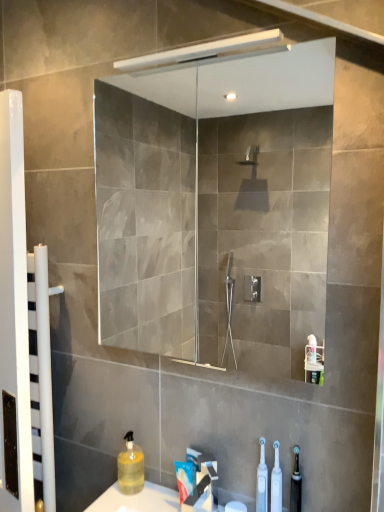
How much space does white plastic toothbrush at lower center, the 2th cleaning product in the left-to-right sequence, occupy vertically?

It is 9.53 inches.

The height and width of the screenshot is (512, 384). What are the coordinates of `white plastic toothbrush at lower center, which is the 1th cleaning product from front to back` in the screenshot? It's located at (276, 482).

The width and height of the screenshot is (384, 512). In order to click on white matte toothpaste at lower center in this screenshot , I will do `click(185, 478)`.

Image resolution: width=384 pixels, height=512 pixels. What do you see at coordinates (14, 315) in the screenshot?
I see `white glossy towel rack at left` at bounding box center [14, 315].

Locate an element on the screen. This screenshot has width=384, height=512. translucent yellow liquid at lower left, which is counted as the 2th cleaning product, starting from the right is located at coordinates (130, 467).

From the image's perspective, is white plastic toothbrushes at lower center, placed as the second toiletry when sorted from right to left, beneath translucent yellow liquid at lower left, marked as the 1th cleaning product in a left-to-right arrangement?

No.

From a real-world perspective, is white plastic toothbrushes at lower center, acting as the first toiletry starting from the left, below translucent yellow liquid at lower left, the first cleaning product in the back-to-front sequence?

No.

What's the angular difference between white plastic toothbrushes at lower center, acting as the first toiletry starting from the left, and translucent yellow liquid at lower left, the first cleaning product in the back-to-front sequence,'s facing directions?

white plastic toothbrushes at lower center, acting as the first toiletry starting from the left, and translucent yellow liquid at lower left, the first cleaning product in the back-to-front sequence, are facing 2.3 degrees away from each other.

Between white plastic toothbrushes at lower center, placed as the second toiletry when sorted from right to left, and translucent yellow liquid at lower left, which appears as the second cleaning product when viewed from the front, which one has less height?

translucent yellow liquid at lower left, which appears as the second cleaning product when viewed from the front, is shorter.

Does point (15, 251) appear closer or farther from the camera than point (276, 448)?

Point (15, 251) is positioned closer to the camera compared to point (276, 448).

From the image's perspective, is white glossy towel rack at left above or below white plastic toothbrush at lower center, the 2th cleaning product positioned from the back?

white glossy towel rack at left is situated higher than white plastic toothbrush at lower center, the 2th cleaning product positioned from the back, in the image.

The width and height of the screenshot is (384, 512). I want to click on cleaning product lying in front of the white glossy towel rack at left, so click(276, 482).

Are transparent glass mirror at upper center and translucent plastic toothbrush at lower right, positioned as the first toiletry in right-to-left order, making contact?

transparent glass mirror at upper center and translucent plastic toothbrush at lower right, positioned as the first toiletry in right-to-left order, are clearly separated.

Looking at the image, does transparent glass mirror at upper center seem bigger or smaller compared to translucent plastic toothbrush at lower right, acting as the second toiletry starting from the left?

Considering their sizes, transparent glass mirror at upper center takes up more space than translucent plastic toothbrush at lower right, acting as the second toiletry starting from the left.

From a real-world perspective, is transparent glass mirror at upper center positioned under translucent plastic toothbrush at lower right, positioned as the first toiletry in right-to-left order, based on gravity?

Incorrect, from a real-world perspective, transparent glass mirror at upper center is higher than translucent plastic toothbrush at lower right, positioned as the first toiletry in right-to-left order.

Consider the image. Which of these two, transparent glass mirror at upper center or translucent plastic toothbrush at lower right, acting as the second toiletry starting from the left, is thinner?

With smaller width is translucent plastic toothbrush at lower right, acting as the second toiletry starting from the left.

Is white plastic toothbrush at lower center, the 1th cleaning product in the right-to-left sequence, aimed at transparent glass mirror at upper center?

No, white plastic toothbrush at lower center, the 1th cleaning product in the right-to-left sequence, is not aimed at transparent glass mirror at upper center.

In terms of size, does white plastic toothbrush at lower center, the 2th cleaning product positioned from the back, appear bigger or smaller than transparent glass mirror at upper center?

white plastic toothbrush at lower center, the 2th cleaning product positioned from the back, is smaller than transparent glass mirror at upper center.

Is the surface of translucent yellow liquid at lower left, marked as the 1th cleaning product in a left-to-right arrangement, in direct contact with translucent plastic toothbrush at lower right, positioned as the first toiletry in right-to-left order?

They are not placed beside each other.

Which of these two, translucent yellow liquid at lower left, the first cleaning product in the back-to-front sequence, or translucent plastic toothbrush at lower right, positioned as the first toiletry in right-to-left order, stands taller?

With more height is translucent plastic toothbrush at lower right, positioned as the first toiletry in right-to-left order.

Based on the photo, which object is further away from the camera, translucent yellow liquid at lower left, the first cleaning product in the back-to-front sequence, or translucent plastic toothbrush at lower right, acting as the second toiletry starting from the left?

translucent yellow liquid at lower left, the first cleaning product in the back-to-front sequence, is more distant.

Does point (130, 486) come in front of point (300, 499)?

No, (130, 486) is behind (300, 499).

Could you tell me if white plastic toothbrush at lower center, the 2th cleaning product in the left-to-right sequence, is facing translucent yellow liquid at lower left, which is counted as the 2th cleaning product, starting from the right?

No, white plastic toothbrush at lower center, the 2th cleaning product in the left-to-right sequence, is not turned towards translucent yellow liquid at lower left, which is counted as the 2th cleaning product, starting from the right.

Is white plastic toothbrush at lower center, the 2th cleaning product in the left-to-right sequence, positioned beyond the bounds of translucent yellow liquid at lower left, which appears as the second cleaning product when viewed from the front?

That's correct, white plastic toothbrush at lower center, the 2th cleaning product in the left-to-right sequence, is outside of translucent yellow liquid at lower left, which appears as the second cleaning product when viewed from the front.

From the image's perspective, does white plastic toothbrush at lower center, which is the 1th cleaning product from front to back, appear higher than translucent yellow liquid at lower left, marked as the 1th cleaning product in a left-to-right arrangement?

Indeed, from the image's perspective, white plastic toothbrush at lower center, which is the 1th cleaning product from front to back, is shown above translucent yellow liquid at lower left, marked as the 1th cleaning product in a left-to-right arrangement.

From a real-world perspective, which object stands above the other?

white plastic toothbrush at lower center, which is the 1th cleaning product from front to back.

Is white plastic toothbrush at lower center, which is the 1th cleaning product from front to back, inside the boundaries of white plastic toothbrushes at lower center, placed as the second toiletry when sorted from right to left, or outside?

white plastic toothbrush at lower center, which is the 1th cleaning product from front to back, cannot be found inside white plastic toothbrushes at lower center, placed as the second toiletry when sorted from right to left.

Is white plastic toothbrush at lower center, which is the 1th cleaning product from front to back, wider than white plastic toothbrushes at lower center, acting as the first toiletry starting from the left?

In fact, white plastic toothbrush at lower center, which is the 1th cleaning product from front to back, might be narrower than white plastic toothbrushes at lower center, acting as the first toiletry starting from the left.

From a real-world perspective, relative to white plastic toothbrushes at lower center, acting as the first toiletry starting from the left, is white plastic toothbrush at lower center, the 2th cleaning product in the left-to-right sequence, vertically above or below?

white plastic toothbrush at lower center, the 2th cleaning product in the left-to-right sequence, is below white plastic toothbrushes at lower center, acting as the first toiletry starting from the left.

From the translucent yellow liquid at lower left, which is counted as the 2th cleaning product, starting from the right, count 1st toiletrys forward and point to it. Please provide its 2D coordinates.

[(262, 481)]

This screenshot has width=384, height=512. I want to click on screen door above the white plastic toothbrush at lower center, which is the 1th cleaning product from front to back (from a real-world perspective), so click(14, 315).

When comparing their distances from translucent yellow liquid at lower left, marked as the 1th cleaning product in a left-to-right arrangement, does white glossy towel rack at left or white matte toothpaste at lower center seem further?

Among the two, white glossy towel rack at left is located further to translucent yellow liquid at lower left, marked as the 1th cleaning product in a left-to-right arrangement.

From the image, which object appears to be farther from white matte toothpaste at lower center, white glossy towel rack at left or transparent glass mirror at upper center?

Based on the image, transparent glass mirror at upper center appears to be further to white matte toothpaste at lower center.

When comparing their distances from white matte toothpaste at lower center, does white plastic toothbrushes at lower center, acting as the first toiletry starting from the left, or translucent yellow liquid at lower left, marked as the 1th cleaning product in a left-to-right arrangement, seem further?

The object further to white matte toothpaste at lower center is white plastic toothbrushes at lower center, acting as the first toiletry starting from the left.

When comparing their distances from white matte toothpaste at lower center, does white glossy towel rack at left or white plastic toothbrushes at lower center, placed as the second toiletry when sorted from right to left, seem closer?

white plastic toothbrushes at lower center, placed as the second toiletry when sorted from right to left, lies closer to white matte toothpaste at lower center than the other object.

When comparing their distances from white plastic toothbrush at lower center, which is the 1th cleaning product from front to back, does translucent yellow liquid at lower left, which appears as the second cleaning product when viewed from the front, or white glossy towel rack at left seem further?

Among the two, white glossy towel rack at left is located further to white plastic toothbrush at lower center, which is the 1th cleaning product from front to back.

Considering their positions, is transparent glass mirror at upper center positioned closer to translucent plastic toothbrush at lower right, positioned as the first toiletry in right-to-left order, than white plastic toothbrush at lower center, the 1th cleaning product in the right-to-left sequence?

white plastic toothbrush at lower center, the 1th cleaning product in the right-to-left sequence, is closer to translucent plastic toothbrush at lower right, positioned as the first toiletry in right-to-left order.

From the picture: Looking at the image, which one is located further to translucent plastic toothbrush at lower right, positioned as the first toiletry in right-to-left order, translucent yellow liquid at lower left, marked as the 1th cleaning product in a left-to-right arrangement, or white matte toothpaste at lower center?

Based on the image, translucent yellow liquid at lower left, marked as the 1th cleaning product in a left-to-right arrangement, appears to be further to translucent plastic toothbrush at lower right, positioned as the first toiletry in right-to-left order.

Based on the photo, which object lies nearer to the anchor point transparent glass mirror at upper center, white matte toothpaste at lower center or white plastic toothbrushes at lower center, placed as the second toiletry when sorted from right to left?

white matte toothpaste at lower center.

The height and width of the screenshot is (512, 384). I want to click on cleaning product between transparent glass mirror at upper center and translucent yellow liquid at lower left, which appears as the second cleaning product when viewed from the front, in the up-down direction, so click(276, 482).

This screenshot has height=512, width=384. In order to click on toiletry between translucent yellow liquid at lower left, which is counted as the 2th cleaning product, starting from the right, and translucent plastic toothbrush at lower right, positioned as the first toiletry in right-to-left order, from left to right in this screenshot , I will do `click(262, 481)`.

The height and width of the screenshot is (512, 384). I want to click on toothpaste located between translucent yellow liquid at lower left, which appears as the second cleaning product when viewed from the front, and translucent plastic toothbrush at lower right, acting as the second toiletry starting from the left, in the left-right direction, so click(x=185, y=478).

Where is `cleaning product between translucent yellow liquid at lower left, which appears as the second cleaning product when viewed from the front, and translucent plastic toothbrush at lower right, positioned as the first toiletry in right-to-left order, in the horizontal direction`? This screenshot has height=512, width=384. cleaning product between translucent yellow liquid at lower left, which appears as the second cleaning product when viewed from the front, and translucent plastic toothbrush at lower right, positioned as the first toiletry in right-to-left order, in the horizontal direction is located at coordinates (276, 482).